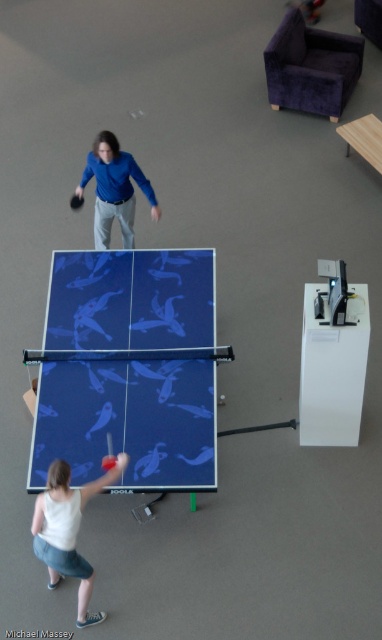
You are a table tennis player standing at the edge of the blue rubber table tennis table at center. You want to place your red rubber table tennis racket at lower left on the table. Can you do that without moving the racket?

The blue rubber table tennis table at center is above the red rubber table tennis racket at lower left, so you can place the red rubber table tennis racket at lower left on the table since it is positioned below the table.